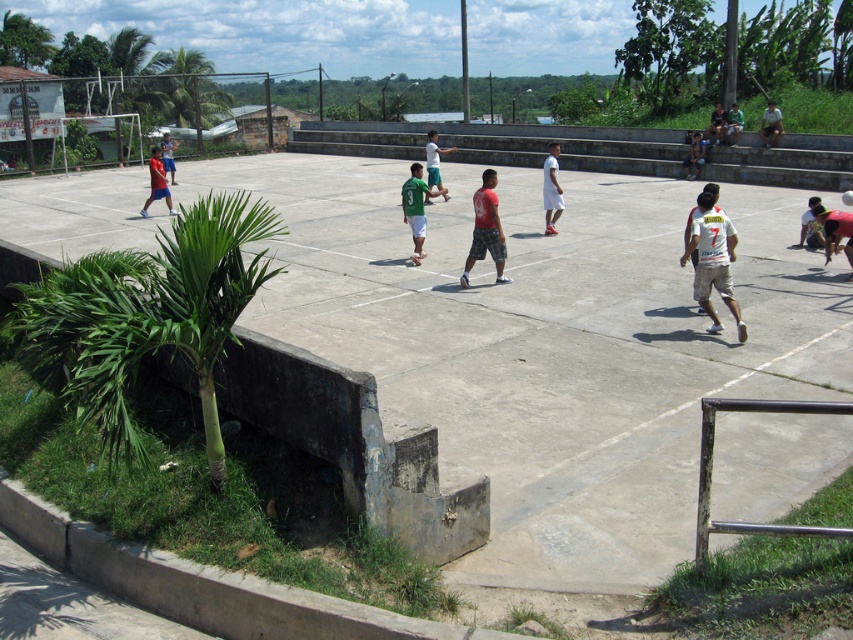
Which is below, concrete court at center or green matte shirt at center?

concrete court at center

Does point (143, 224) come farther from viewer compared to point (442, 189)?

No.

Is point (338, 221) positioned after point (421, 214)?

Yes.

What are the coordinates of `concrete court at center` in the screenshot? It's located at (547, 342).

Between concrete court at center and white jersey at right, which one is positioned higher?

concrete court at center is above.

Locate an element on the screen. The image size is (853, 640). concrete court at center is located at coordinates (547, 342).

Identify the location of concrete court at center. (547, 342).

In order to click on green matte shirt at center in this screenshot , I will do `click(416, 209)`.